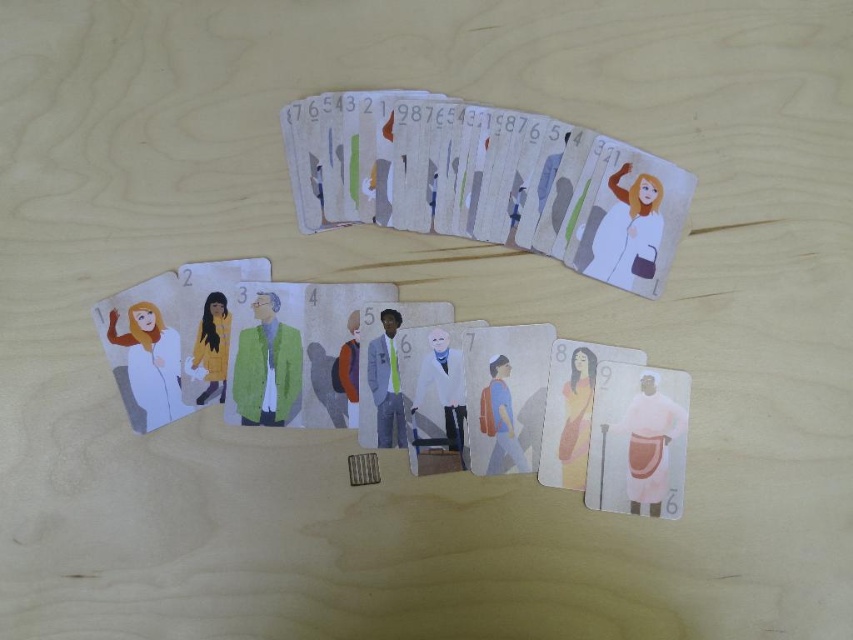
Question: Does light blue fabric suit at center appear over yellow matte jacket at center?

Choices:
 (A) no
 (B) yes

Answer: (A)

Question: Does white matte lab coat at center have a smaller size compared to light blue fabric suit at center?

Choices:
 (A) no
 (B) yes

Answer: (B)

Question: Does white matte lab coat at center appear on the right side of matte pink dress at center?

Choices:
 (A) no
 (B) yes

Answer: (A)

Question: Which point appears farthest from the camera in this image?

Choices:
 (A) (653, 451)
 (B) (201, 342)
 (C) (396, 381)
 (D) (163, 326)

Answer: (B)

Question: Which object is closer to the camera taking this photo?

Choices:
 (A) green textured sweater at center
 (B) light brown backpack at center

Answer: (B)

Question: Among these points, which one is nearest to the camera?

Choices:
 (A) (579, 348)
 (B) (492, 449)
 (C) (293, 326)
 (D) (639, 488)

Answer: (D)